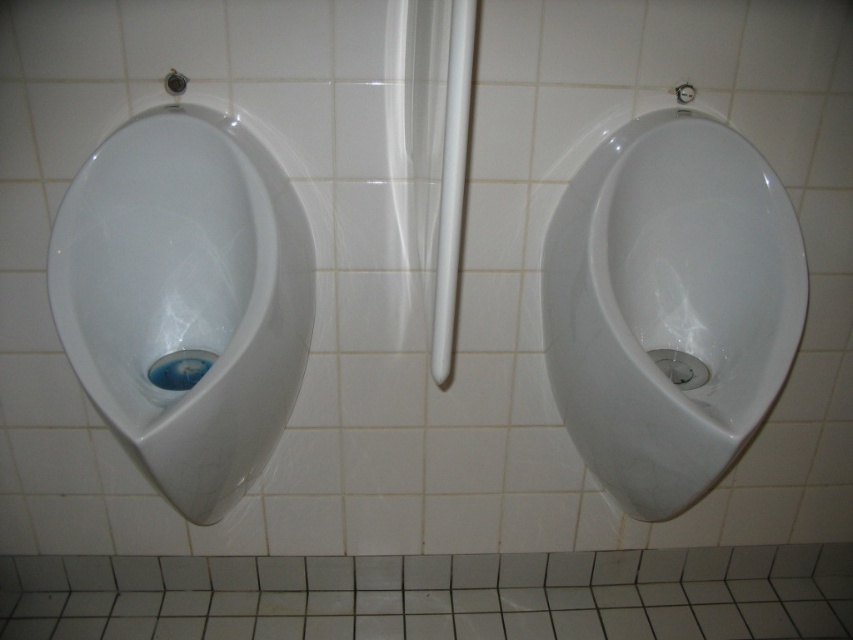
Where is `white glossy urinal at center`? white glossy urinal at center is located at coordinates (669, 305).

Is point (613, 227) in front of point (277, 211)?

No.

Identify the location of white glossy urinal at center. (669, 305).